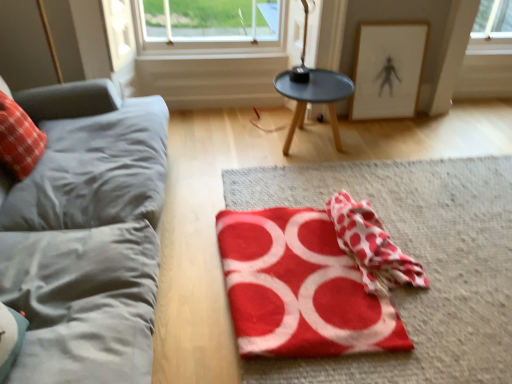
This screenshot has width=512, height=384. I want to click on free space between red polka dot fabric at center and red felt yoga mat at center, so click(416, 314).